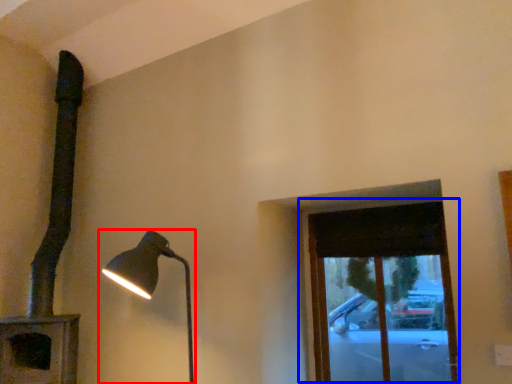
Question: Which of the following is the farthest to the observer, lamp (highlighted by a red box) or window (highlighted by a blue box)?

Choices:
 (A) lamp
 (B) window

Answer: (B)